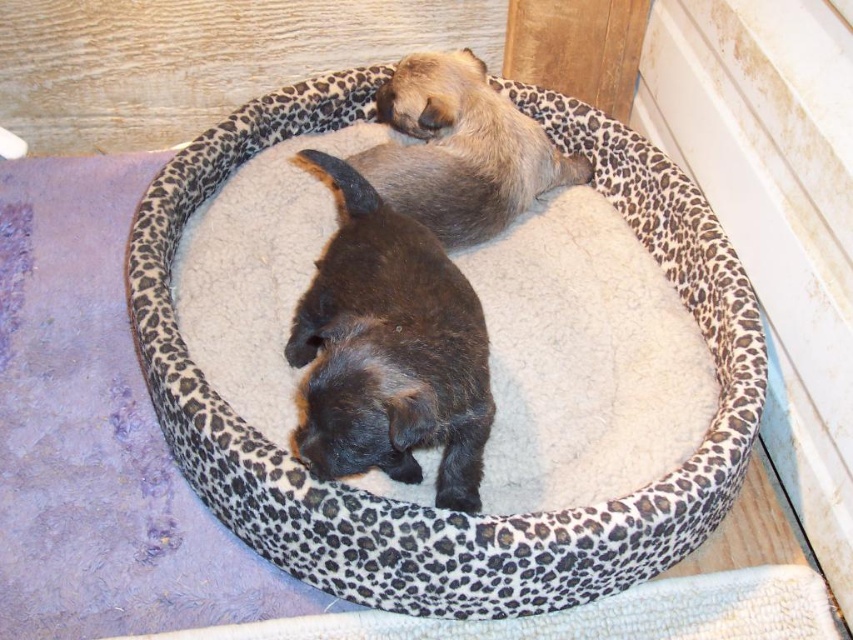
In the scene shown: You are a photographer trying to capture a clear shot of both the black fur dog at center and the fuzzy beige dog at upper center. Since you want both dogs to be visible in the photo, which dog should you focus on first to ensure the other remains in the frame?

The black fur dog at center is in front of the fuzzy beige dog at upper center, so you should focus on the black fur dog at center first to ensure the fuzzy beige dog at upper center stays visible behind it.